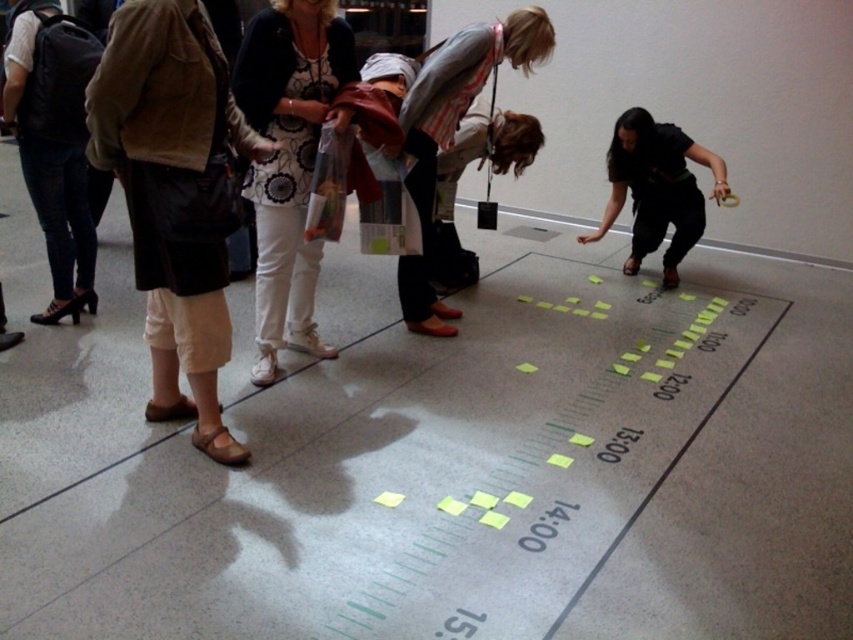
You are a photographer standing behind the group to capture a photo of the white cotton pants at center and the striped fabric shirt at center. Which one should you focus on first if you want to ensure both are in focus, considering their heights?

The white cotton pants at center has a greater height compared to striped fabric shirt at center, so you should focus on the white cotton pants at center first to ensure both are in focus.